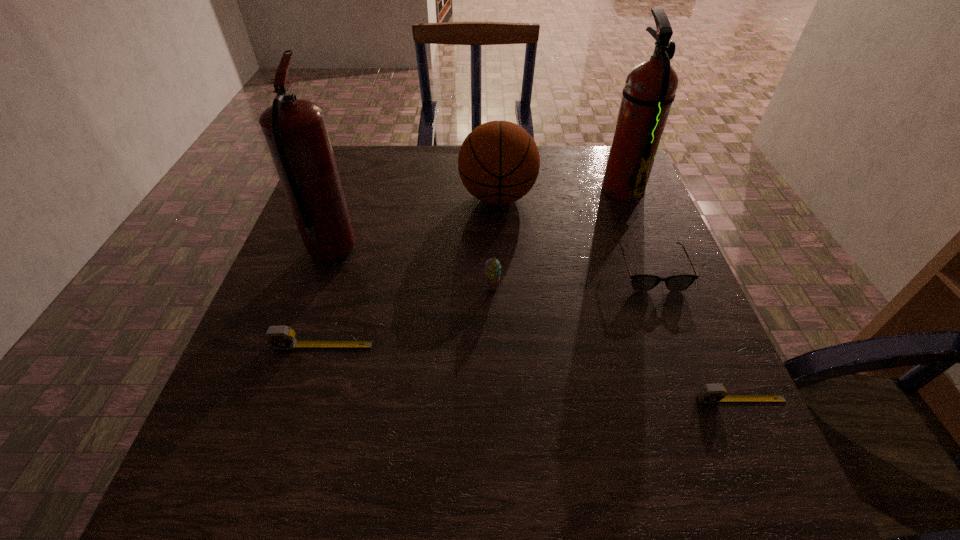
At what (x,y) coordinates should I click in order to perform the action: click on vacant space in between the basketball and the spectacles. Please return your answer as a coordinate pair (x, y). Looking at the image, I should click on (574, 234).

Where is `free space between the right fire extinguisher and the nearer tape measure`? The height and width of the screenshot is (540, 960). free space between the right fire extinguisher and the nearer tape measure is located at coordinates (682, 294).

Identify the location of vacant area that lies between the spectacles and the taller tape measure. This screenshot has width=960, height=540. (487, 308).

Find the location of `empty location between the left tape measure and the left fire extinguisher`. empty location between the left tape measure and the left fire extinguisher is located at coordinates (327, 299).

Identify the location of object that is the second closest one to the spectacles. This screenshot has height=540, width=960. (498, 163).

Identify which object is located as the second nearest to the sherbert. Please provide its 2D coordinates. Your answer should be formatted as a tuple, i.e. [(x, y)], where the tuple contains the x and y coordinates of a point satisfying the conditions above.

[(279, 337)]

At what (x,y) coordinates should I click in order to perform the action: click on vacant position in the image that satisfies the following two spatial constraints: 1. at the nozzle of the farther fire extinguisher; 2. at the front view of the spectacles. Please return your answer as a coordinate pair (x, y). The width and height of the screenshot is (960, 540). Looking at the image, I should click on (655, 271).